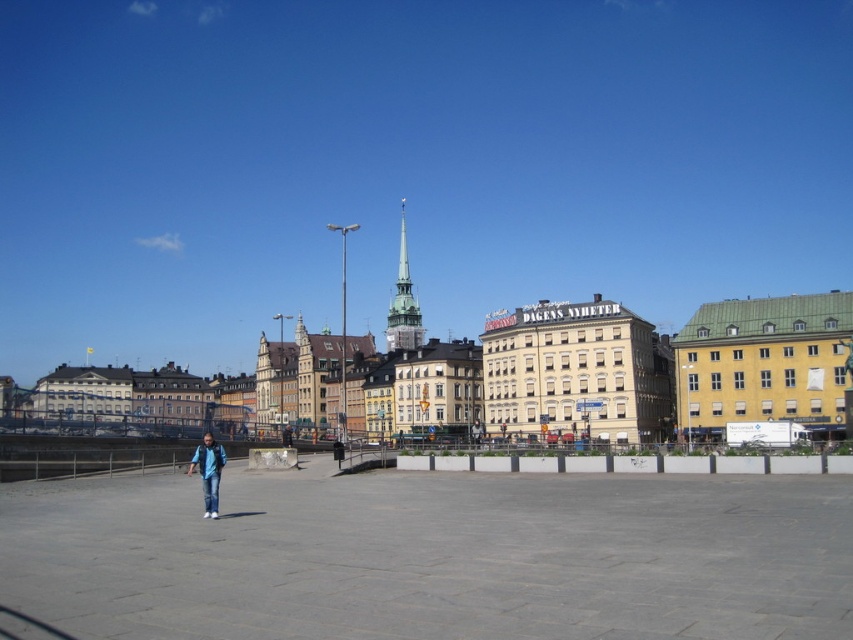
Does blue jeans at center lie in front of blue denim jeans at center?

Yes, it is in front of blue denim jeans at center.

Does blue jeans at center have a lesser height compared to blue denim jeans at center?

No.

Does point (338, 456) lie in front of point (283, 440)?

That is True.

Where is `blue jeans at center`? Image resolution: width=853 pixels, height=640 pixels. blue jeans at center is located at coordinates (338, 452).

Is gold textured spire at center shorter than blue denim jeans at lower left?

In fact, gold textured spire at center may be taller than blue denim jeans at lower left.

Which is below, gold textured spire at center or blue denim jeans at lower left?

Positioned lower is blue denim jeans at lower left.

Does point (403, 253) come closer to viewer compared to point (219, 467)?

No, (403, 253) is further to viewer.

Image resolution: width=853 pixels, height=640 pixels. Find the location of `gold textured spire at center`. gold textured spire at center is located at coordinates (403, 301).

From the picture: Is blue denim jeans at lower left thinner than blue denim jeans at center?

Incorrect, blue denim jeans at lower left's width is not less than blue denim jeans at center's.

The width and height of the screenshot is (853, 640). What do you see at coordinates (207, 472) in the screenshot? I see `blue denim jeans at lower left` at bounding box center [207, 472].

Does point (207, 509) come behind point (289, 435)?

No, it is not.

Where is `blue denim jeans at lower left`? blue denim jeans at lower left is located at coordinates (207, 472).